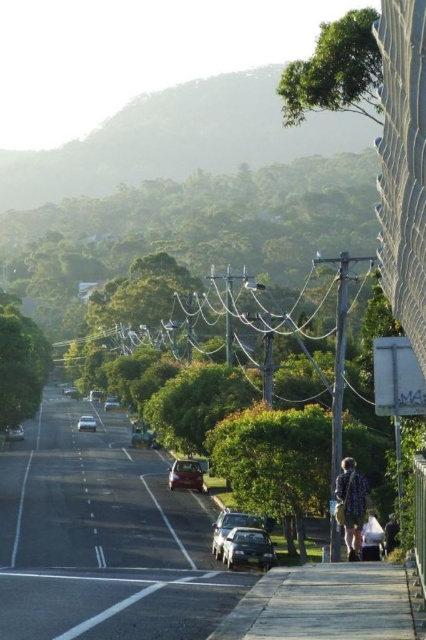
Does white cotton shirt at lower right have a greater height compared to metallic silver car at center?

No.

Which of these two, white cotton shirt at lower right or metallic silver car at center, stands taller?

metallic silver car at center is taller.

Between point (365, 556) and point (83, 420), which one is positioned in front?

Positioned in front is point (365, 556).

You are a GUI agent. You are given a task and a screenshot of the screen. Output one action in this format:
    pyautogui.click(x=<x>, y=<y>)
    Task: Click on the white cotton shirt at lower right
    Image resolution: width=426 pixels, height=640 pixels.
    Given the screenshot: What is the action you would take?
    pyautogui.click(x=371, y=538)

Between dark blue jeans at lower right and shiny silver sedan at lower left, which one is positioned lower?

Positioned lower is shiny silver sedan at lower left.

Is dark blue jeans at lower right to the left of shiny silver sedan at lower left from the viewer's perspective?

In fact, dark blue jeans at lower right is to the right of shiny silver sedan at lower left.

Identify the location of dark blue jeans at lower right. The image size is (426, 640). (391, 532).

In the scene shown: Which is more to the right, satin silver suv at lower center or shiny metallic car at center?

Positioned to the right is satin silver suv at lower center.

How much distance is there between satin silver suv at lower center and shiny metallic car at center?

15.12 meters

Where is `satin silver suv at lower center`? This screenshot has width=426, height=640. satin silver suv at lower center is located at coordinates (230, 528).